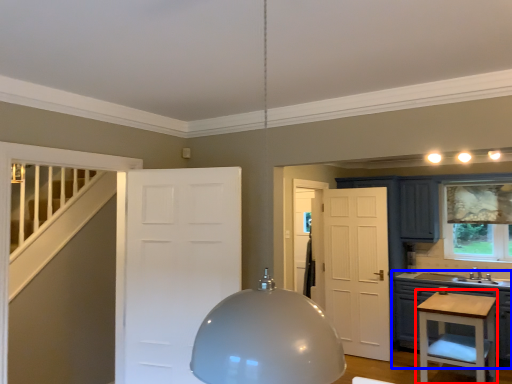
Question: Which point is closer to the camera, vanity (highlighted by a red box) or cabinetry (highlighted by a blue box)?

Choices:
 (A) vanity
 (B) cabinetry

Answer: (A)